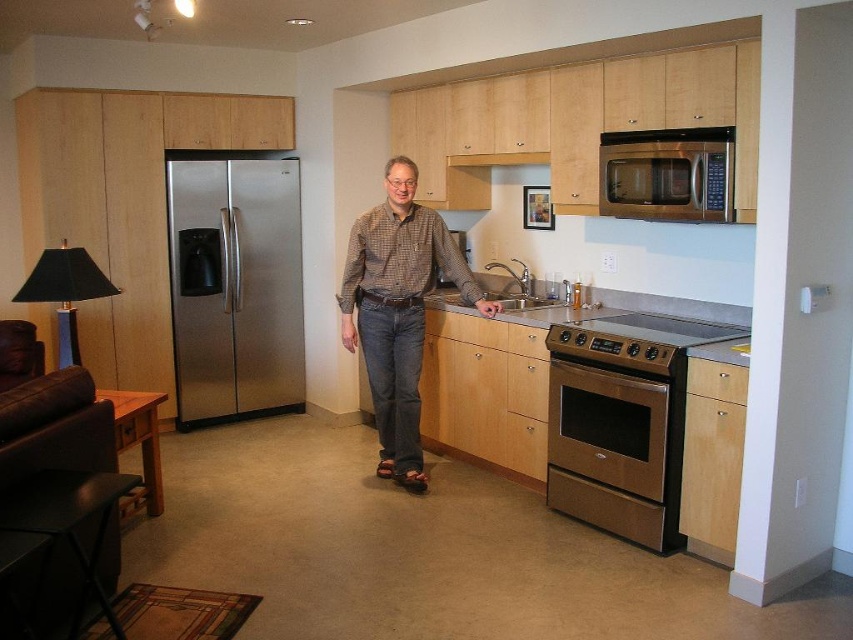
Looking at this image, between stainless steel refrigerator at left and bronze metallic oven at lower right, which one has more height?

stainless steel refrigerator at left is taller.

Is point (289, 243) closer to camera compared to point (607, 512)?

No.

Locate an element on the screen. The width and height of the screenshot is (853, 640). stainless steel refrigerator at left is located at coordinates (235, 285).

Is point (399, 337) positioned after point (610, 332)?

Yes, it is behind point (610, 332).

Find the location of `brown checkered shirt at center`. brown checkered shirt at center is located at coordinates (398, 310).

Who is lower down, brown checkered shirt at center or stainless steel microwave at upper right?

brown checkered shirt at center

Can you confirm if brown checkered shirt at center is bigger than stainless steel microwave at upper right?

Indeed, brown checkered shirt at center has a larger size compared to stainless steel microwave at upper right.

This screenshot has height=640, width=853. What do you see at coordinates (398, 310) in the screenshot? I see `brown checkered shirt at center` at bounding box center [398, 310].

Where is `brown checkered shirt at center`? brown checkered shirt at center is located at coordinates (398, 310).